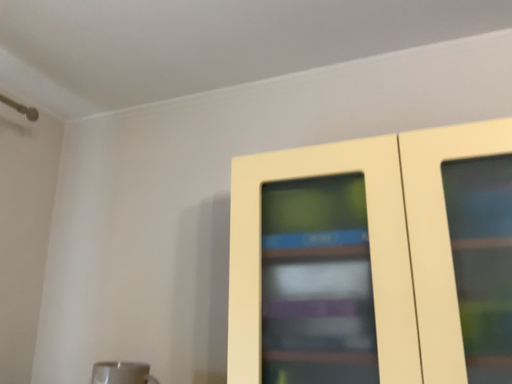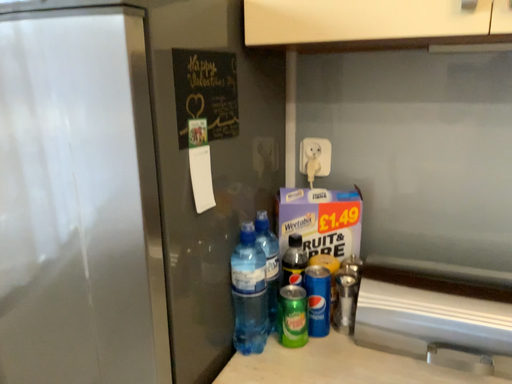
Question: How did the camera likely rotate when shooting the video?

Choices:
 (A) rotated downward
 (B) rotated upward

Answer: (A)